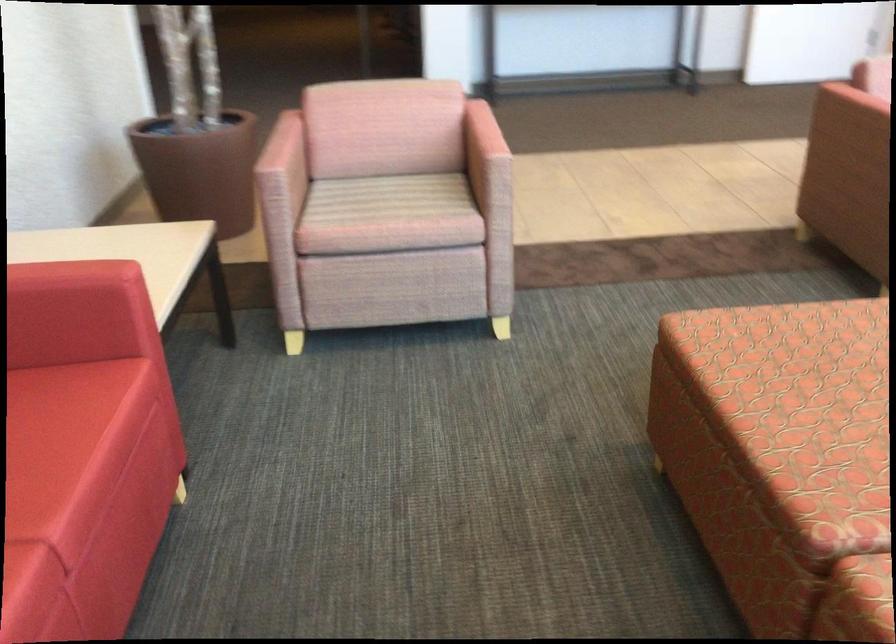
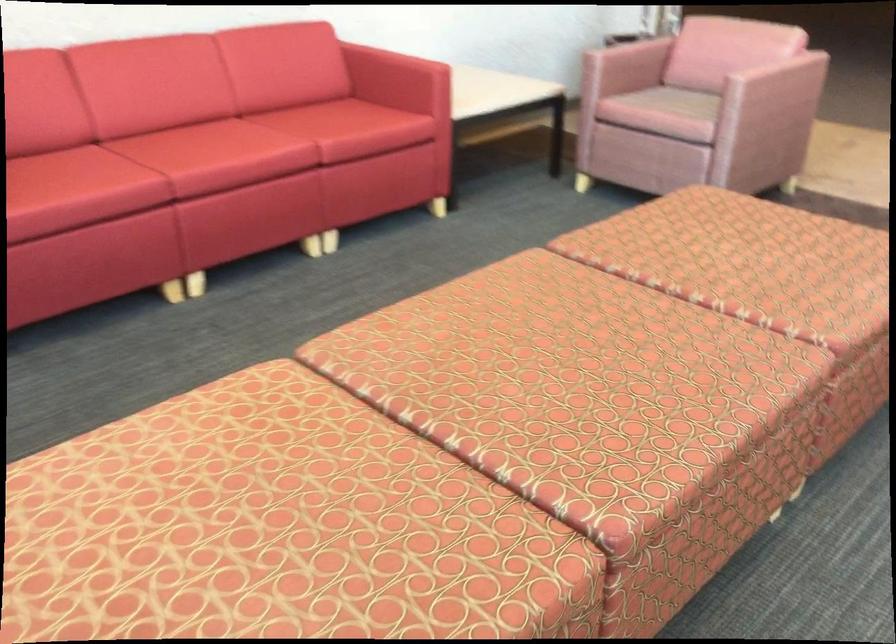
Locate, in the second image, the point that corresponds to [286,162] in the first image.

(627, 58)